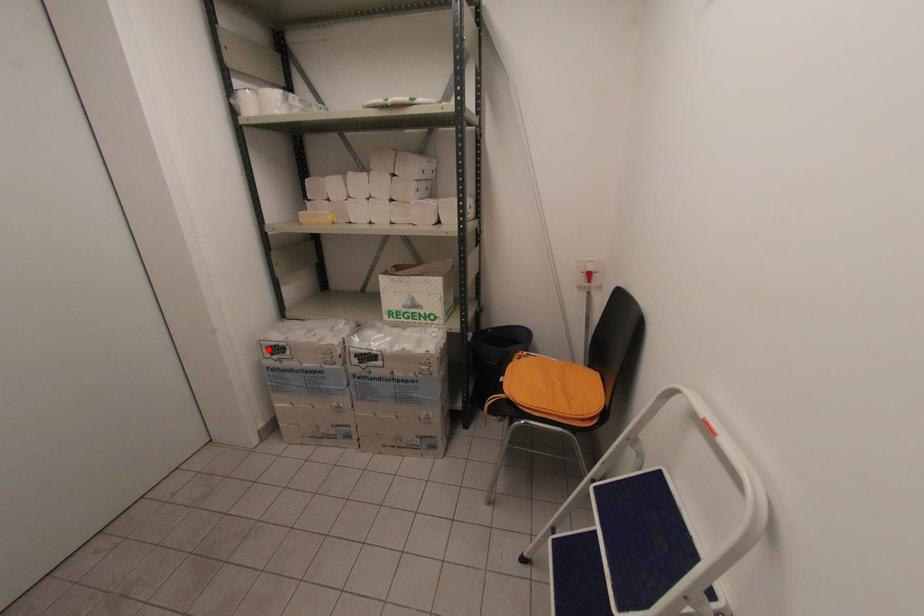
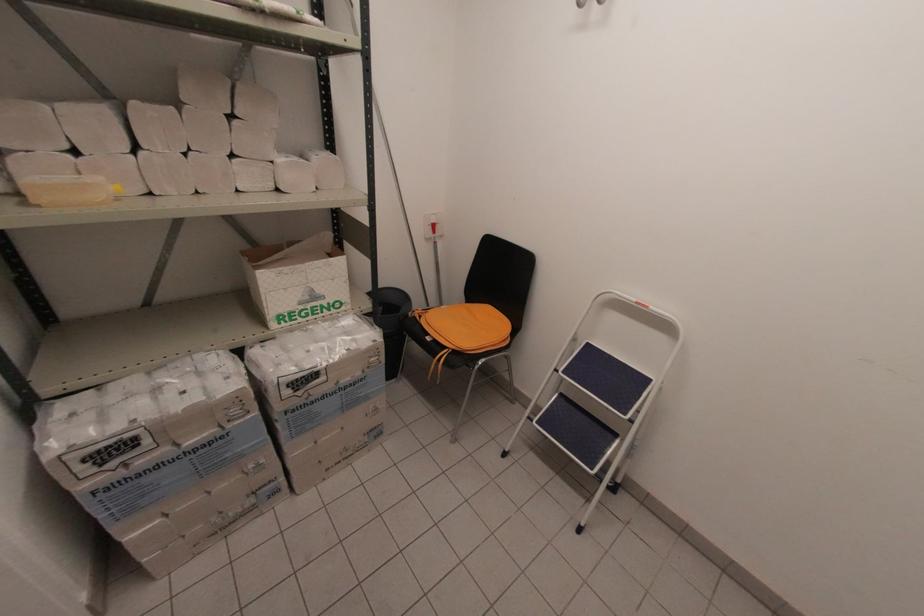
Question: I am providing you with two images of the same scene from different viewpoints. A red point is shown in image1. For the corresponding object point in image2, is it positioned nearer or farther from the camera?

Choices:
 (A) Nearer
 (B) Farther

Answer: (A)